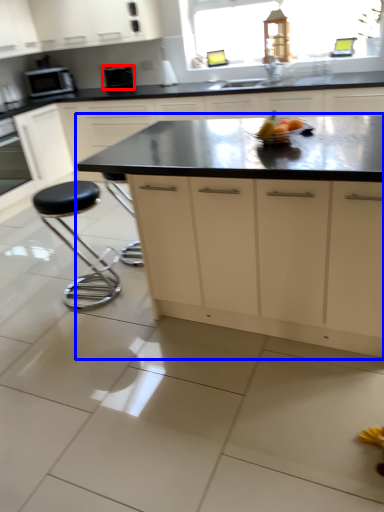
Question: Which object is further to the camera taking this photo, kitchen appliance (highlighted by a red box) or cabinetry (highlighted by a blue box)?

Choices:
 (A) kitchen appliance
 (B) cabinetry

Answer: (A)